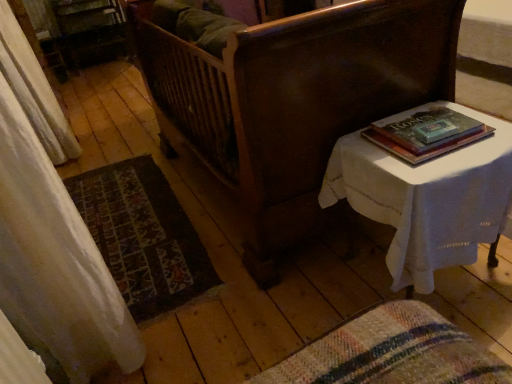
Question: From the image's perspective, is white sheer curtain at left over white cloth-covered table at right?

Choices:
 (A) yes
 (B) no

Answer: (A)

Question: Is white sheer curtain at left in front of white cloth-covered table at right?

Choices:
 (A) no
 (B) yes

Answer: (A)

Question: Is white cloth-covered table at right completely or partially inside white sheer curtain at left?

Choices:
 (A) yes
 (B) no

Answer: (B)

Question: From the image's perspective, is white sheer curtain at left below white cloth-covered table at right?

Choices:
 (A) no
 (B) yes

Answer: (A)

Question: Can you confirm if white sheer curtain at left is bigger than white cloth-covered table at right?

Choices:
 (A) no
 (B) yes

Answer: (B)

Question: Does white sheer curtain at left have a smaller size compared to white cloth-covered table at right?

Choices:
 (A) yes
 (B) no

Answer: (B)

Question: Does hardcover book at upper right have a larger size compared to carpeted mat at lower left?

Choices:
 (A) no
 (B) yes

Answer: (A)

Question: Could you tell me if hardcover book at upper right is turned towards carpeted mat at lower left?

Choices:
 (A) yes
 (B) no

Answer: (B)

Question: Can carpeted mat at lower left be found inside hardcover book at upper right?

Choices:
 (A) no
 (B) yes

Answer: (A)

Question: Considering the relative sizes of hardcover book at upper right and carpeted mat at lower left in the image provided, is hardcover book at upper right thinner than carpeted mat at lower left?

Choices:
 (A) yes
 (B) no

Answer: (A)

Question: From a real-world perspective, is hardcover book at upper right on carpeted mat at lower left?

Choices:
 (A) no
 (B) yes

Answer: (B)

Question: Is hardcover book at upper right oriented away from carpeted mat at lower left?

Choices:
 (A) no
 (B) yes

Answer: (A)

Question: Does hardcover book at upper right have a greater height compared to white cloth-covered table at right?

Choices:
 (A) no
 (B) yes

Answer: (A)